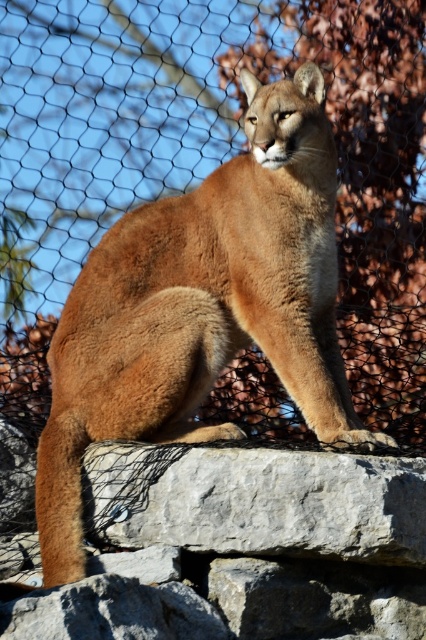
You are a zookeeper trying to place two feeding stations for the cougar. The first station must be placed at point A, which is at point (276, 323), and the second station at point B, which is at point (143, 628). From the cougar enclosure, which feeding station is closer to the viewing area behind the fence?

Point A at (276, 323) is behind point B at (143, 628). Therefore, the feeding station at point B is closer to the viewing area behind the fence.

You are a zookeeper observing the cougar enclosure. You notice the gray stone boulder at center and the gray rough rock at lower center. Which rock is closer to the black wire mesh fence?

The gray rough rock at lower center is behind the gray stone boulder at center, so the gray stone boulder at center is closer to the fence.

You are a zookeeper observing the cougar in its enclosure. You notice a specific point marked at coordinates (x=201, y=308). Based on the scene description, what does this point most likely represent?

The point at coordinates (x=201, y=308) most likely represents the golden fur cougar at center as indicated in the Objects Description.